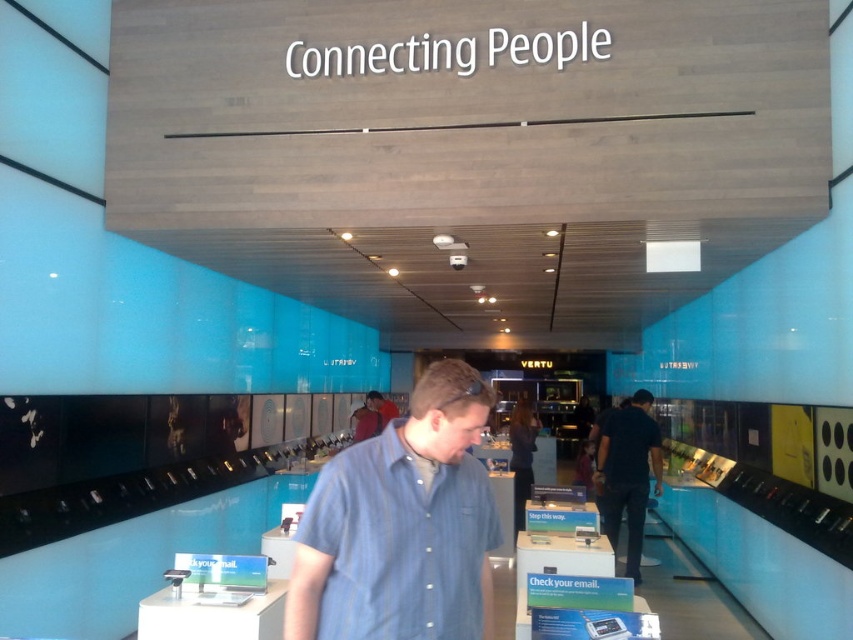
Question: Which object appears farthest from the camera in this image?

Choices:
 (A) dark blue shirt at center
 (B) blue striped shirt at center

Answer: (A)

Question: Is blue striped shirt at center closer to camera compared to dark blue shirt at center?

Choices:
 (A) yes
 (B) no

Answer: (A)

Question: Which point is closer to the camera?

Choices:
 (A) (640, 468)
 (B) (412, 506)

Answer: (B)

Question: Can you confirm if blue striped shirt at center is wider than dark blue shirt at center?

Choices:
 (A) yes
 (B) no

Answer: (A)

Question: Is blue striped shirt at center positioned in front of dark blue shirt at center?

Choices:
 (A) yes
 (B) no

Answer: (A)